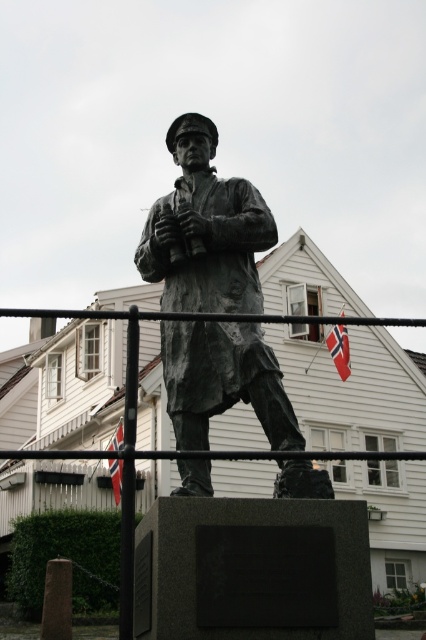
You are a park visitor observing the statue and its surroundings. You notice two flags, the white fabric flag at upper center and the red fabric flag at center. Which flag is shorter in height?

The white fabric flag at upper center is shorter in height compared to the red fabric flag at center.

You are a photographer trying to capture both the bronze statue at center and the white fabric flag at upper center in a single frame. Given that the statue is larger than the flag, which object should you position closer to the camera to ensure both are visible in the frame?

Since the bronze statue at center is larger in size than the white fabric flag at upper center, you should position the bronze statue at center closer to the camera. This way, the statue will take up more space in the frame, while the smaller white fabric flag at upper center can be placed further back, ensuring both are visible.